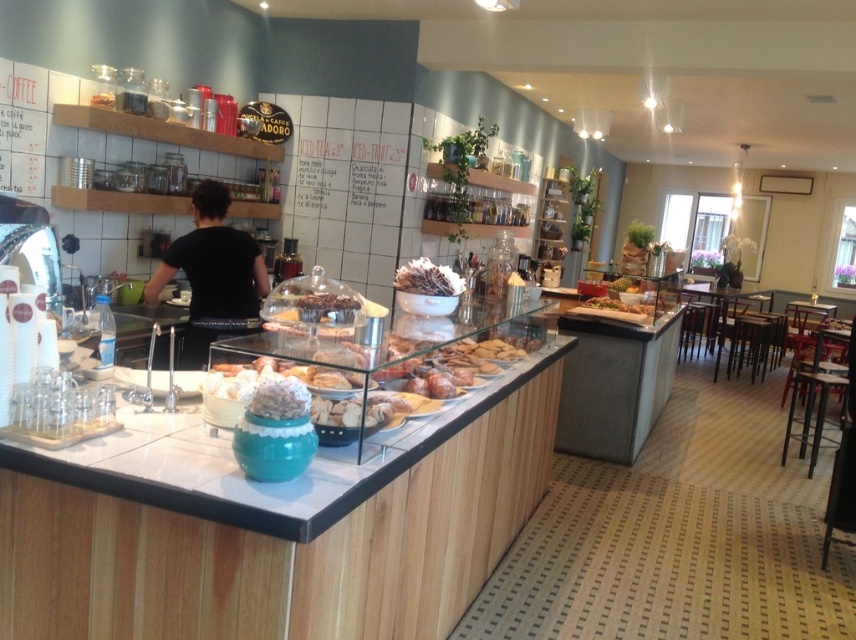
Question: In this image, where is wooden counter top at center located relative to black fabric shirt at center?

Choices:
 (A) above
 (B) below

Answer: (B)

Question: Which object is positioned farthest from the wooden counter top at center?

Choices:
 (A) chocolate-covered nuts at center
 (B) black fabric shirt at center

Answer: (B)

Question: Does black fabric shirt at center have a smaller size compared to chocolate-covered nuts at center?

Choices:
 (A) yes
 (B) no

Answer: (B)

Question: Which point is closer to the camera?

Choices:
 (A) chocolate-covered nuts at center
 (B) black fabric shirt at center
 (C) wooden counter top at center

Answer: (C)

Question: Which point is farther from the camera taking this photo?

Choices:
 (A) (456, 282)
 (B) (210, 332)
 (C) (31, 468)

Answer: (B)

Question: Is black fabric shirt at center in front of chocolate-covered nuts at center?

Choices:
 (A) yes
 (B) no

Answer: (B)